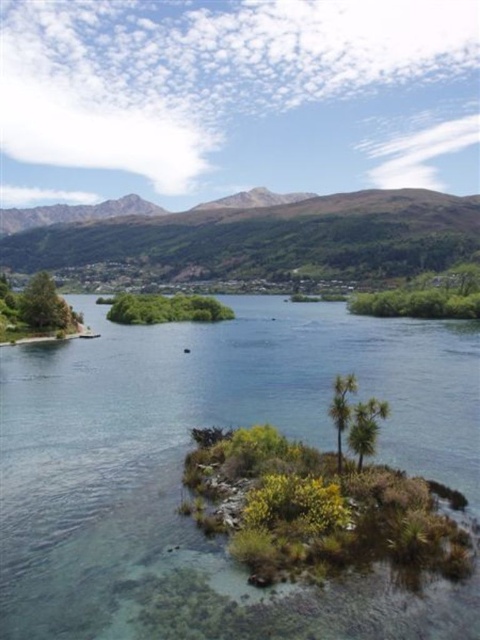
Question: Considering the relative positions of green forested mountain at upper center and green leafy palm tree at center-right in the image provided, where is green forested mountain at upper center located with respect to green leafy palm tree at center-right?

Choices:
 (A) left
 (B) right

Answer: (A)

Question: Which point is farther to the camera?

Choices:
 (A) (309, 310)
 (B) (323, 257)

Answer: (B)

Question: Estimate the real-world distances between objects in this image. Which object is closer to the green leafy palm tree at center?

Choices:
 (A) green leafy palm tree at center-right
 (B) green forested mountain at upper center
 (C) clear water at center

Answer: (A)

Question: Considering the real-world distances, which object is farthest from the clear water at center?

Choices:
 (A) green leafy palm tree at center
 (B) green leafy palm tree at center-right
 (C) green forested mountain at upper center

Answer: (C)

Question: Where is clear water at center located in relation to green leafy palm tree at center in the image?

Choices:
 (A) right
 (B) left

Answer: (A)

Question: Observing the image, what is the correct spatial positioning of green forested mountain at upper center in reference to green leafy palm tree at center?

Choices:
 (A) right
 (B) left

Answer: (B)